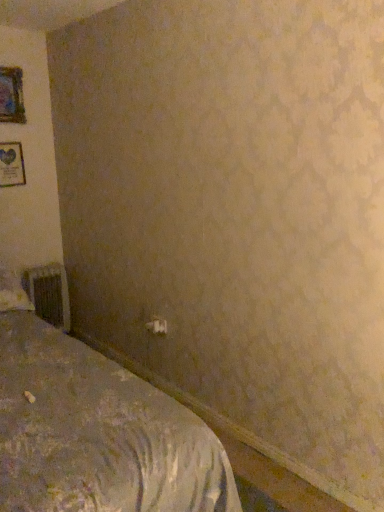
Question: Are white fabric pillow at left and textured gray bed at lower left far apart?

Choices:
 (A) yes
 (B) no

Answer: (B)

Question: Does white fabric pillow at left have a greater width compared to textured gray bed at lower left?

Choices:
 (A) no
 (B) yes

Answer: (A)

Question: Can you confirm if white fabric pillow at left is shorter than textured gray bed at lower left?

Choices:
 (A) yes
 (B) no

Answer: (A)

Question: Would you say white fabric pillow at left contains textured gray bed at lower left?

Choices:
 (A) yes
 (B) no

Answer: (B)

Question: Is the position of white fabric pillow at left more distant than that of textured gray bed at lower left?

Choices:
 (A) no
 (B) yes

Answer: (B)

Question: Is point (11, 294) closer or farther from the camera than point (148, 323)?

Choices:
 (A) farther
 (B) closer

Answer: (B)

Question: From a real-world perspective, relative to white plastic electric outlet at lower center, is white fabric pillow at left vertically above or below?

Choices:
 (A) below
 (B) above

Answer: (B)

Question: Would you say white fabric pillow at left is to the left or to the right of white plastic electric outlet at lower center in the picture?

Choices:
 (A) right
 (B) left

Answer: (B)

Question: Considering the positions of white fabric pillow at left and white plastic electric outlet at lower center in the image, is white fabric pillow at left taller or shorter than white plastic electric outlet at lower center?

Choices:
 (A) short
 (B) tall

Answer: (B)

Question: Is textured gray bed at lower left in front of or behind white fabric pillow at left in the image?

Choices:
 (A) behind
 (B) front

Answer: (B)

Question: Based on their positions, is textured gray bed at lower left located to the left or right of white fabric pillow at left?

Choices:
 (A) right
 (B) left

Answer: (A)

Question: Looking at the image, does textured gray bed at lower left seem bigger or smaller compared to white fabric pillow at left?

Choices:
 (A) small
 (B) big

Answer: (B)

Question: In terms of height, does textured gray bed at lower left look taller or shorter compared to white fabric pillow at left?

Choices:
 (A) short
 (B) tall

Answer: (B)

Question: Considering the positions of metallic silver radiator at lower left and white plastic electric outlet at lower center in the image, is metallic silver radiator at lower left taller or shorter than white plastic electric outlet at lower center?

Choices:
 (A) tall
 (B) short

Answer: (A)

Question: Considering the positions of metallic silver radiator at lower left and white plastic electric outlet at lower center in the image, is metallic silver radiator at lower left bigger or smaller than white plastic electric outlet at lower center?

Choices:
 (A) big
 (B) small

Answer: (A)